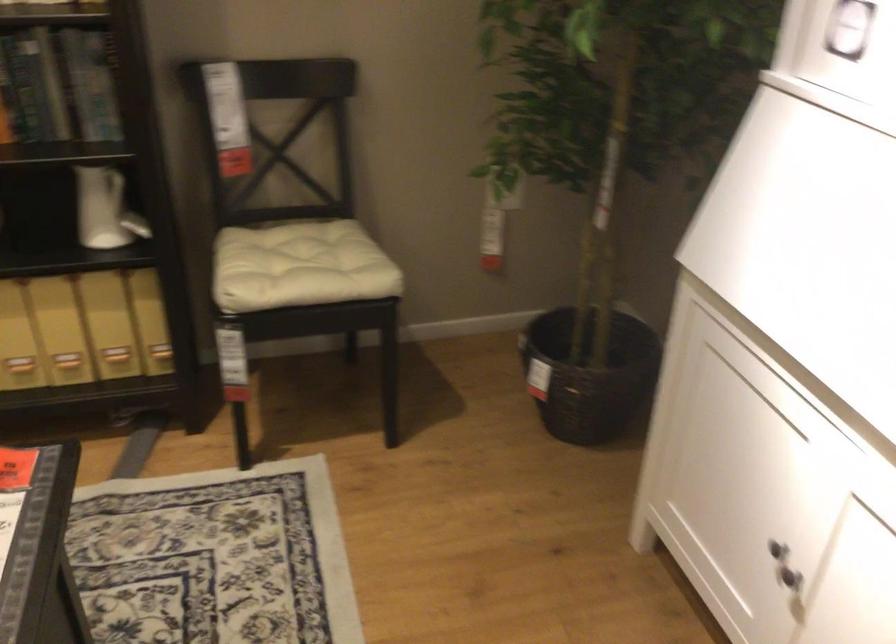
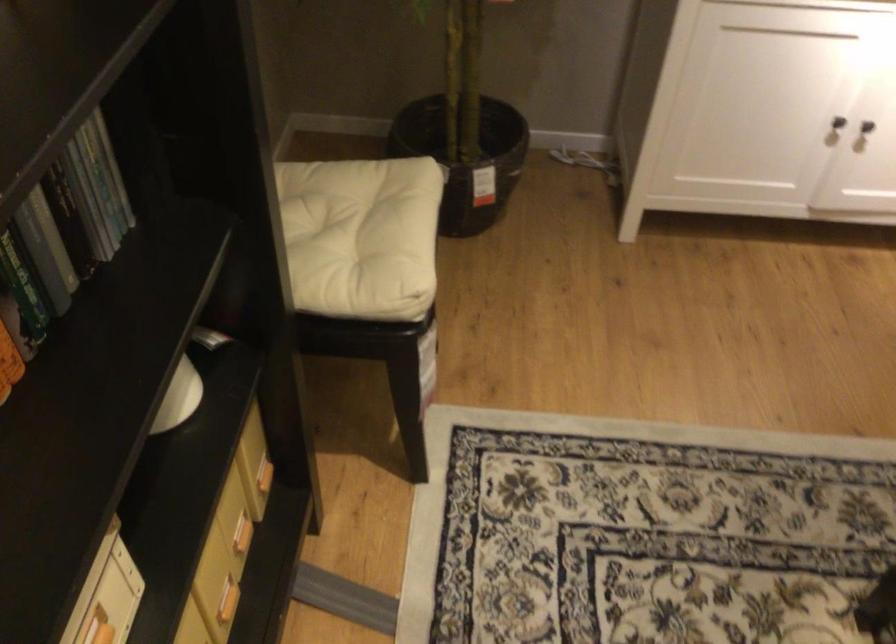
Question: I am providing you with two images of the same scene from different viewpoints. Which of the following objects are not visible in image2?

Choices:
 (A) chair sitting surface
 (B) book
 (C) yellow box handle
 (D) none of these

Answer: (D)